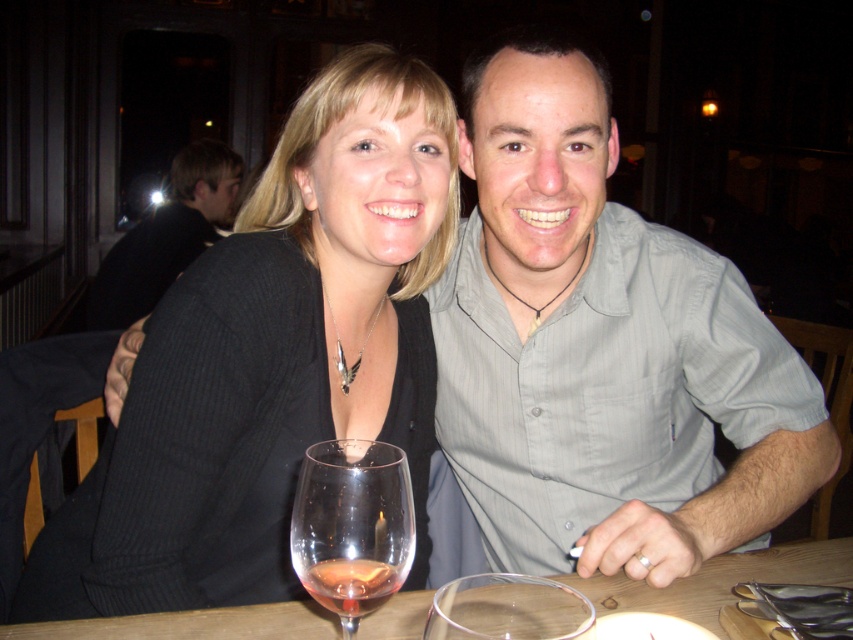
In order to click on black sweater at center in this screenshot , I will do `click(273, 358)`.

Identify the location of black sweater at center. Image resolution: width=853 pixels, height=640 pixels. point(273,358).

Is black sweater at center thinner than wooden table at center?

Indeed, black sweater at center has a lesser width compared to wooden table at center.

Does black sweater at center have a larger size compared to wooden table at center?

Correct, black sweater at center is larger in size than wooden table at center.

Locate an element on the screen. The image size is (853, 640). black sweater at center is located at coordinates point(273,358).

Find the location of `black sweater at center`. black sweater at center is located at coordinates (273, 358).

Can you confirm if black sweater at center is thinner than transparent glass wine glass at center?

In fact, black sweater at center might be wider than transparent glass wine glass at center.

Who is positioned more to the right, black sweater at center or transparent glass wine glass at center?

transparent glass wine glass at center

Measure the distance between point (375, 170) and camera.

39.19 inches

Image resolution: width=853 pixels, height=640 pixels. Find the location of `black sweater at center`. black sweater at center is located at coordinates (273, 358).